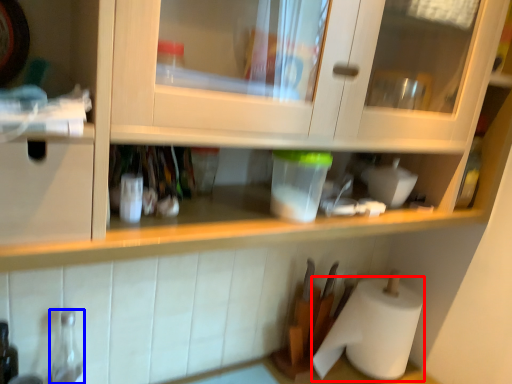
Question: Which of the following is the closest to the observer, paper towel (highlighted by a red box) or bottle (highlighted by a blue box)?

Choices:
 (A) paper towel
 (B) bottle

Answer: (B)